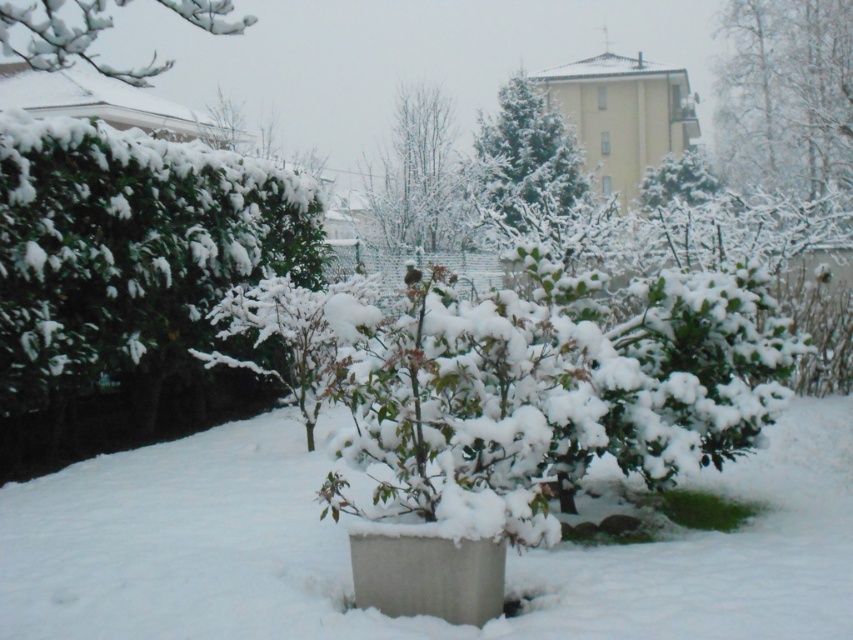
Who is positioned more to the left, green leafy bush at left or white snow-covered tree at upper right?

From the viewer's perspective, green leafy bush at left appears more on the left side.

Does green leafy bush at left have a larger size compared to white snow-covered tree at upper right?

Incorrect, green leafy bush at left is not larger than white snow-covered tree at upper right.

Find the location of a particular element. green leafy bush at left is located at coordinates (128, 284).

Is point (238, 250) farther from camera compared to point (422, 166)?

No, it is in front of (422, 166).

Which is above, green leafy bush at left or bare branches at center?

bare branches at center

Identify the location of green leafy bush at left. (128, 284).

You are a GUI agent. You are given a task and a screenshot of the screen. Output one action in this format:
    pyautogui.click(x=<x>, y=<y>)
    Task: Click on the green leafy bush at left
    The width and height of the screenshot is (853, 640).
    Given the screenshot: What is the action you would take?
    pyautogui.click(x=128, y=284)

Does white snow-covered tree at upper right have a lesser height compared to white snow-covered branch at upper left?

Indeed, white snow-covered tree at upper right has a lesser height compared to white snow-covered branch at upper left.

Is white snow-covered tree at upper right smaller than white snow-covered branch at upper left?

Correct, white snow-covered tree at upper right occupies less space than white snow-covered branch at upper left.

The height and width of the screenshot is (640, 853). Find the location of `white snow-covered tree at upper right`. white snow-covered tree at upper right is located at coordinates (786, 93).